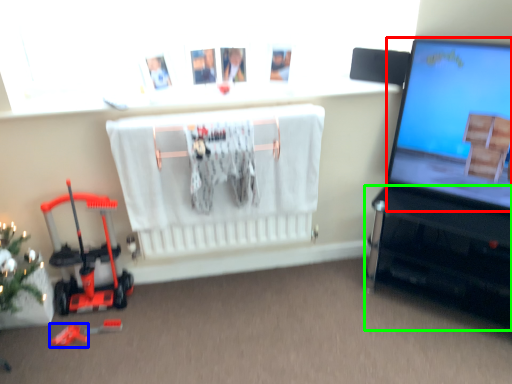
Question: Estimate the real-world distances between objects in this image. Which object is closer to computer screen (highlighted by a red box), toy (highlighted by a blue box) or furniture (highlighted by a green box)?

Choices:
 (A) toy
 (B) furniture

Answer: (B)